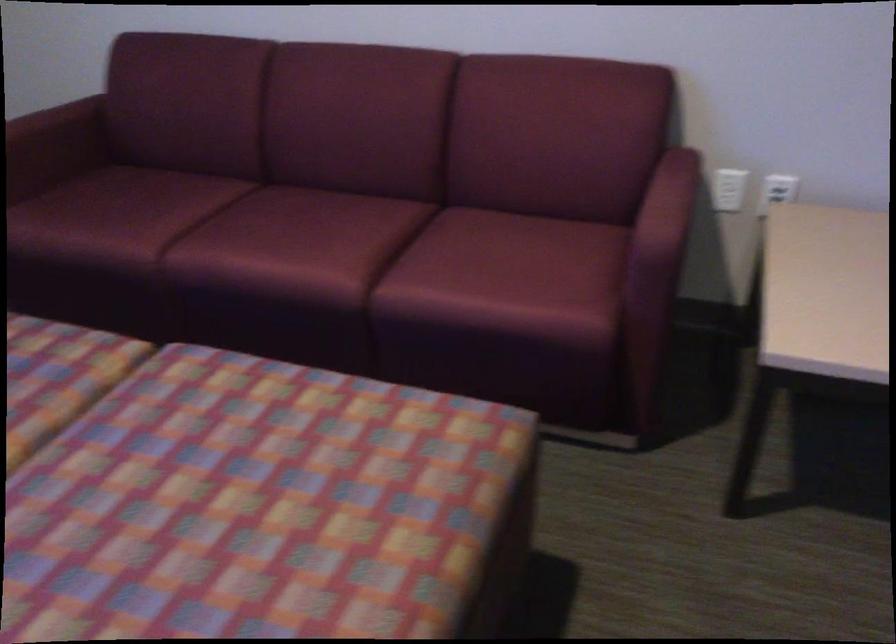
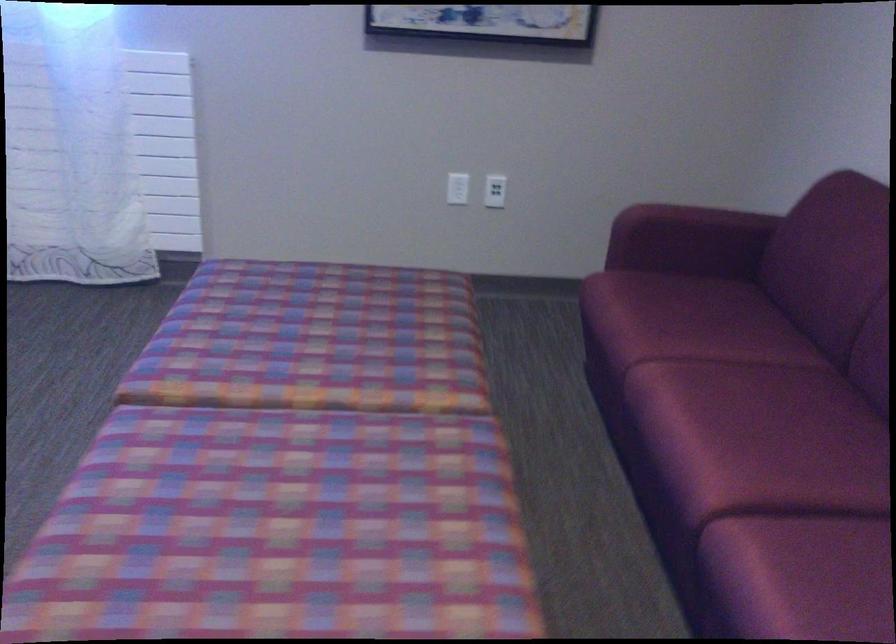
Where in the second image is the point corresponding to point 337,238 from the first image?

(764, 456)